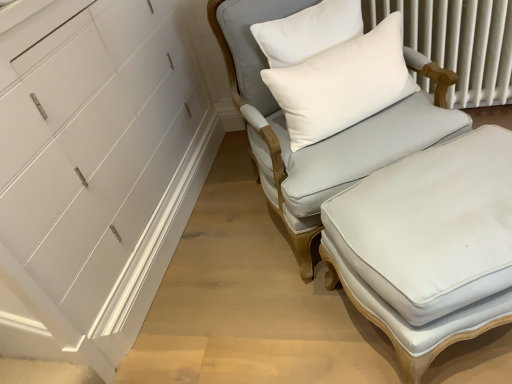
Question: In terms of size, does white soft cushion at upper right appear bigger or smaller than light gray fabric chair at center?

Choices:
 (A) small
 (B) big

Answer: (A)

Question: In terms of width, does white soft cushion at upper right look wider or thinner when compared to light gray fabric chair at center?

Choices:
 (A) wide
 (B) thin

Answer: (B)

Question: Which object is positioned closest to the white soft cushion at upper right?

Choices:
 (A) white textured radiator at upper right
 (B) light gray fabric chair at center
 (C) white fabric ottoman at center

Answer: (B)

Question: Estimate the real-world distances between objects in this image. Which object is farther from the white fabric ottoman at center?

Choices:
 (A) white soft cushion at upper right
 (B) white textured radiator at upper right
 (C) light gray fabric chair at center

Answer: (B)